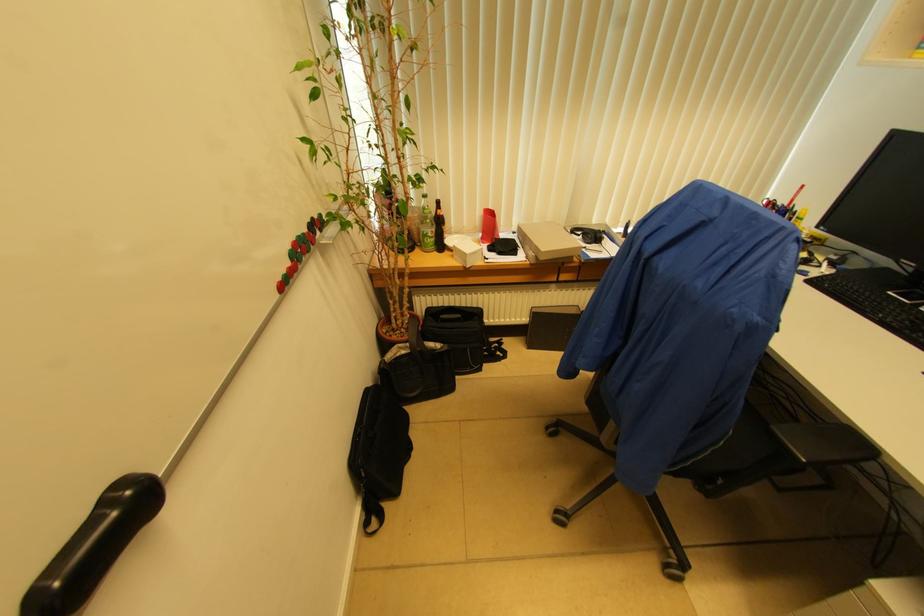
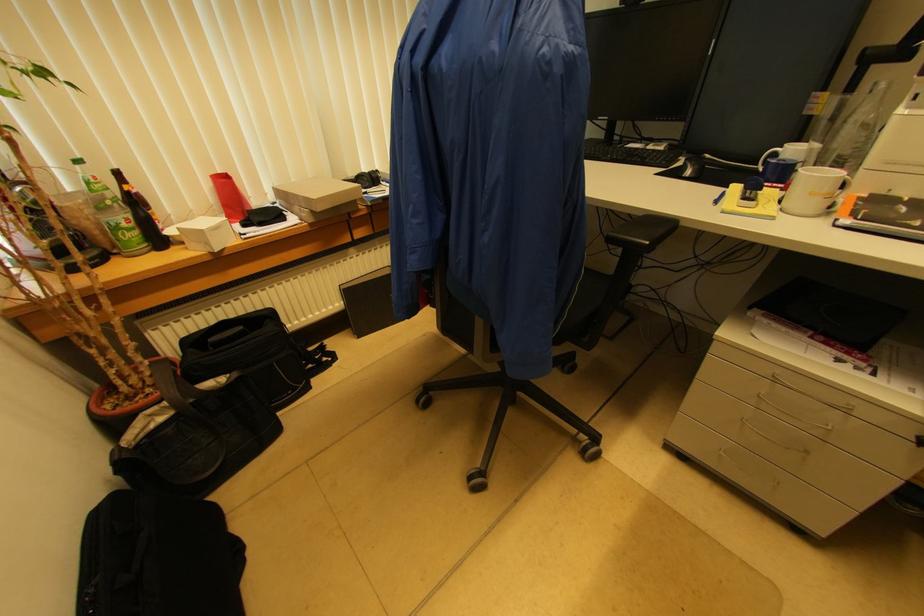
The point at (435, 233) is marked in the first image. Where is the corresponding point in the second image?

(131, 219)